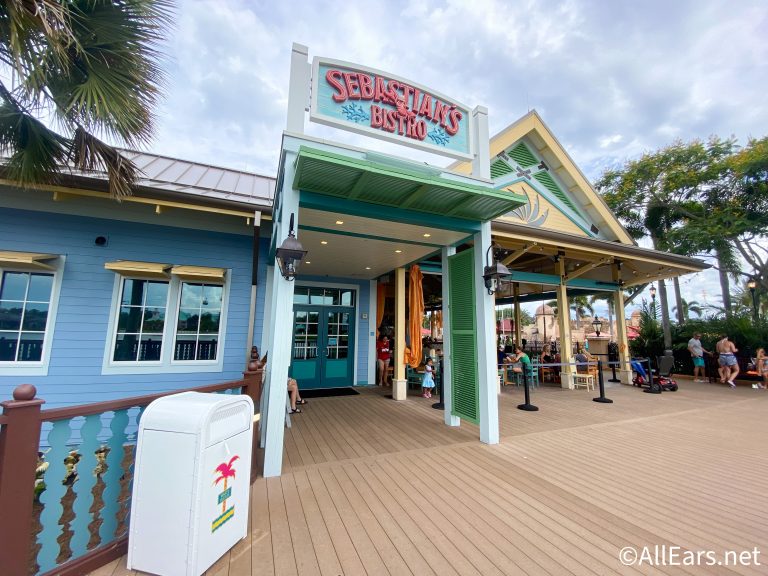
I want to click on door, so click(x=306, y=353), click(x=336, y=356).